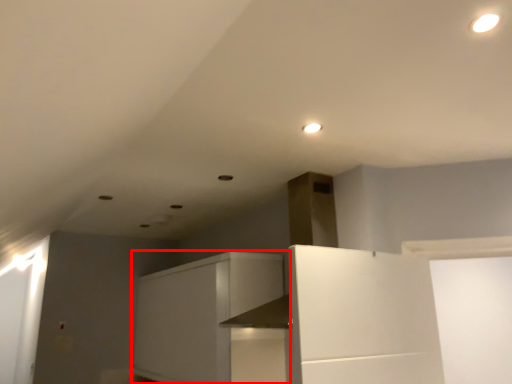
Question: From the image, what is the correct spatial relationship of cabinetry (annotated by the red box) in relation to lighting?

Choices:
 (A) right
 (B) left

Answer: (B)